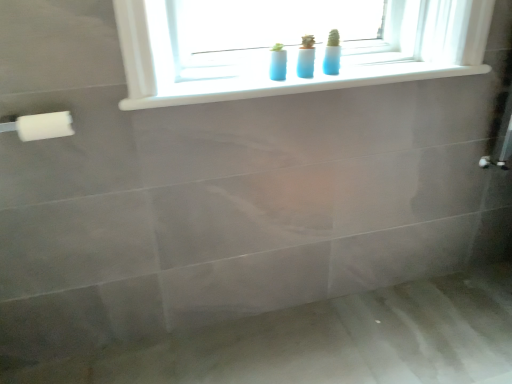
Question: Does white plastic window sill at upper center have a greater height compared to white plastic towel bar at left?

Choices:
 (A) yes
 (B) no

Answer: (B)

Question: Considering the relative sizes of white plastic window sill at upper center and white plastic towel bar at left in the image provided, is white plastic window sill at upper center thinner than white plastic towel bar at left?

Choices:
 (A) no
 (B) yes

Answer: (A)

Question: From a real-world perspective, is white plastic window sill at upper center below white plastic towel bar at left?

Choices:
 (A) no
 (B) yes

Answer: (A)

Question: Considering the relative sizes of white plastic window sill at upper center and white plastic towel bar at left in the image provided, is white plastic window sill at upper center smaller than white plastic towel bar at left?

Choices:
 (A) yes
 (B) no

Answer: (B)

Question: Is white plastic window sill at upper center to the right of white plastic towel bar at left from the viewer's perspective?

Choices:
 (A) yes
 (B) no

Answer: (A)

Question: Is white plastic window sill at upper center wider or thinner than white plastic towel bar at left?

Choices:
 (A) thin
 (B) wide

Answer: (B)

Question: From the image's perspective, is white plastic window sill at upper center positioned above or below white plastic towel bar at left?

Choices:
 (A) above
 (B) below

Answer: (A)

Question: Does point (245, 94) appear closer or farther from the camera than point (26, 120)?

Choices:
 (A) farther
 (B) closer

Answer: (A)

Question: Considering the relative positions of white plastic window sill at upper center and white plastic towel bar at left in the image provided, is white plastic window sill at upper center to the left or to the right of white plastic towel bar at left?

Choices:
 (A) left
 (B) right

Answer: (B)

Question: Relative to matte gray bath at lower center, is white plastic window sill at upper center in front or behind?

Choices:
 (A) behind
 (B) front

Answer: (A)

Question: Is white plastic window sill at upper center to the left or to the right of matte gray bath at lower center in the image?

Choices:
 (A) left
 (B) right

Answer: (A)

Question: Considering the positions of white plastic window sill at upper center and matte gray bath at lower center in the image, is white plastic window sill at upper center taller or shorter than matte gray bath at lower center?

Choices:
 (A) short
 (B) tall

Answer: (B)

Question: Is white plastic window sill at upper center inside or outside of matte gray bath at lower center?

Choices:
 (A) outside
 (B) inside

Answer: (A)

Question: Would you say white plastic towel bar at left is inside or outside matte gray bath at lower center?

Choices:
 (A) outside
 (B) inside

Answer: (A)

Question: From the image's perspective, is white plastic towel bar at left located above or below matte gray bath at lower center?

Choices:
 (A) above
 (B) below

Answer: (A)